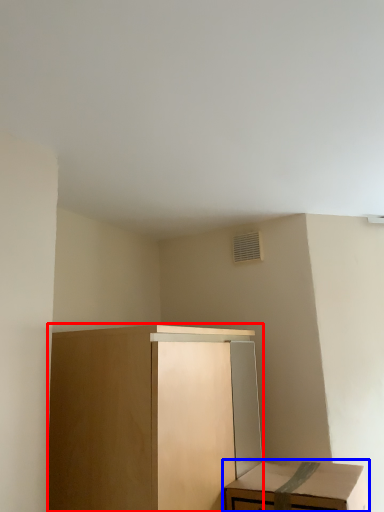
Question: Which of the following is the closest to the observer, cabinetry (highlighted by a red box) or table (highlighted by a blue box)?

Choices:
 (A) cabinetry
 (B) table

Answer: (A)